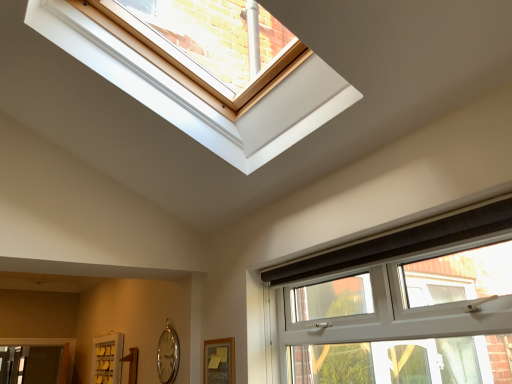
Describe the element at coordinates (399, 242) in the screenshot. The image size is (512, 384). I see `white plastic window at lower right` at that location.

At what (x,y) coordinates should I click in order to perform the action: click on white plastic window at lower right. Please return your answer as a coordinate pair (x, y). The height and width of the screenshot is (384, 512). Looking at the image, I should click on (399, 242).

From the image's perspective, between white plastic window at lower right and white matte screen door at lower left, who is located below?

white matte screen door at lower left, from the image's perspective.

Could white matte screen door at lower left be considered to be inside white plastic window at lower right?

No.

Which of these two, white plastic window at lower right or white matte screen door at lower left, is thinner?

white matte screen door at lower left is thinner.

From a real-world perspective, is white plastic window at lower right on white matte screen door at lower left?

Yes, from a real-world perspective, white plastic window at lower right is above white matte screen door at lower left.

Is point (162, 383) in front of point (485, 205)?

No, (162, 383) is further to viewer.

Does silver metallic clock at lower left touch white plastic window at lower right?

silver metallic clock at lower left is not next to white plastic window at lower right, and they're not touching.

Who is bigger, silver metallic clock at lower left or white plastic window at lower right?

white plastic window at lower right.

Is white plastic window at lower right not close to silver metallic clock at lower left?

Absolutely, white plastic window at lower right is distant from silver metallic clock at lower left.

The height and width of the screenshot is (384, 512). In order to click on clock located behind the white plastic window at lower right in this screenshot , I will do `click(168, 354)`.

From a real-world perspective, which object stands above the other?

white plastic window at lower right.

Can you confirm if white plastic window at lower right is shorter than silver metallic clock at lower left?

In fact, white plastic window at lower right may be taller than silver metallic clock at lower left.

Looking at their sizes, would you say white matte screen door at lower left is wider or thinner than silver metallic clock at lower left?

white matte screen door at lower left is wider than silver metallic clock at lower left.

Can we say white matte screen door at lower left lies outside silver metallic clock at lower left?

Yes, white matte screen door at lower left is located beyond the bounds of silver metallic clock at lower left.

Consider the image. Would you consider white matte screen door at lower left to be distant from silver metallic clock at lower left?

Yes.

From a real-world perspective, is white matte screen door at lower left positioned under white plastic window at lower right based on gravity?

Indeed, from a real-world perspective, white matte screen door at lower left is positioned beneath white plastic window at lower right.

The height and width of the screenshot is (384, 512). I want to click on screen door below the white plastic window at lower right (from a real-world perspective), so click(x=106, y=358).

Can you see white matte screen door at lower left touching white plastic window at lower right?

There is a gap between white matte screen door at lower left and white plastic window at lower right.

Is white matte screen door at lower left aimed at white plastic window at lower right?

No, white matte screen door at lower left is not facing towards white plastic window at lower right.

From the image's perspective, relative to white matte screen door at lower left, is silver metallic clock at lower left above or below?

silver metallic clock at lower left is situated higher than white matte screen door at lower left in the image.

Which object is positioned more to the right, silver metallic clock at lower left or white matte screen door at lower left?

Positioned to the right is silver metallic clock at lower left.

Does silver metallic clock at lower left have a lesser width compared to white matte screen door at lower left?

Yes, silver metallic clock at lower left is thinner than white matte screen door at lower left.

Considering the sizes of objects silver metallic clock at lower left and white matte screen door at lower left in the image provided, who is bigger, silver metallic clock at lower left or white matte screen door at lower left?

Bigger between the two is white matte screen door at lower left.

You are a GUI agent. You are given a task and a screenshot of the screen. Output one action in this format:
    pyautogui.click(x=<x>, y=<y>)
    Task: Click on the window in front of the white matte screen door at lower left
    The width and height of the screenshot is (512, 384).
    Given the screenshot: What is the action you would take?
    [399, 242]

At what (x,y) coordinates should I click in order to perform the action: click on window that appears above the silver metallic clock at lower left (from a real-world perspective). Please return your answer as a coordinate pair (x, y). Looking at the image, I should click on (399, 242).

Looking at the image, which one is located closer to silver metallic clock at lower left, white matte screen door at lower left or white plastic window at lower right?

white matte screen door at lower left lies closer to silver metallic clock at lower left than the other object.

Estimate the real-world distances between objects in this image. Which object is further from white matte screen door at lower left, white plastic window at lower right or silver metallic clock at lower left?

Based on the image, white plastic window at lower right appears to be further to white matte screen door at lower left.

Estimate the real-world distances between objects in this image. Which object is closer to silver metallic clock at lower left, white plastic window at lower right or white matte screen door at lower left?

white matte screen door at lower left is positioned closer to the anchor silver metallic clock at lower left.

Based on their spatial positions, is silver metallic clock at lower left or white matte screen door at lower left closer to white plastic window at lower right?

The object closer to white plastic window at lower right is silver metallic clock at lower left.

Which object lies nearer to the anchor point white plastic window at lower right, white matte screen door at lower left or silver metallic clock at lower left?

Among the two, silver metallic clock at lower left is located nearer to white plastic window at lower right.

Estimate the real-world distances between objects in this image. Which object is closer to white matte screen door at lower left, silver metallic clock at lower left or white plastic window at lower right?

silver metallic clock at lower left is closer to white matte screen door at lower left.

This screenshot has width=512, height=384. Identify the location of clock between white plastic window at lower right and white matte screen door at lower left from front to back. (168, 354).